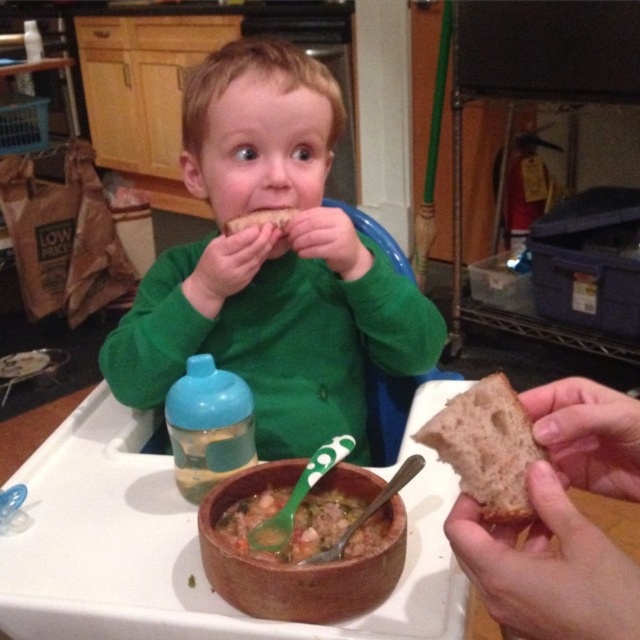
You are a parent preparing to give your child either the brown matte bread at right or the blue plastic bottle at lower left. Which item should you hand to the child first if you want to give them the smaller item first?

The brown matte bread at right has a smaller size compared to the blue plastic bottle at lower left, so you should hand the brown matte bread at right first.